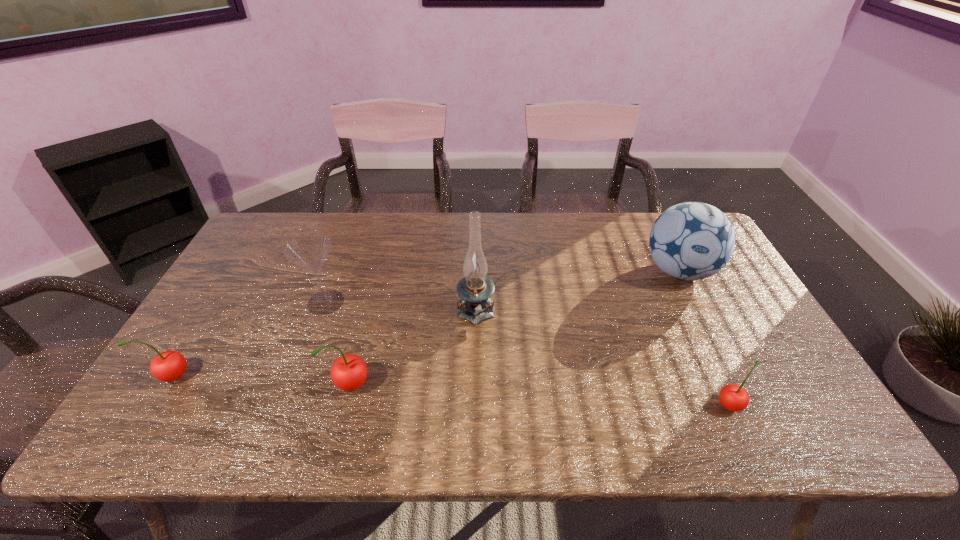
The image size is (960, 540). What are the coordinates of `free space located 0.230m on the left of the second cherry from left to right` in the screenshot? It's located at (236, 385).

This screenshot has height=540, width=960. I want to click on free space located 0.130m on the left of the shortest cherry, so click(x=659, y=405).

Image resolution: width=960 pixels, height=540 pixels. In order to click on free spot located on the side with brand of the soccer ball in this screenshot , I will do `click(701, 315)`.

Find the location of `vacant space situated 0.280m on the right of the flute glass`. vacant space situated 0.280m on the right of the flute glass is located at coordinates (444, 302).

Locate an element on the screen. This screenshot has height=540, width=960. free space located 0.240m on the back of the oil lamp is located at coordinates (476, 239).

The height and width of the screenshot is (540, 960). Find the location of `object present at the far edge`. object present at the far edge is located at coordinates (690, 241).

Where is `object at the left edge`? This screenshot has width=960, height=540. object at the left edge is located at coordinates (167, 366).

This screenshot has height=540, width=960. What are the coordinates of `object situated at the right edge` in the screenshot? It's located at (690, 241).

Locate an element on the screen. The height and width of the screenshot is (540, 960). object present at the near left corner is located at coordinates (167, 366).

Identify the location of object that is at the far right corner. (690, 241).